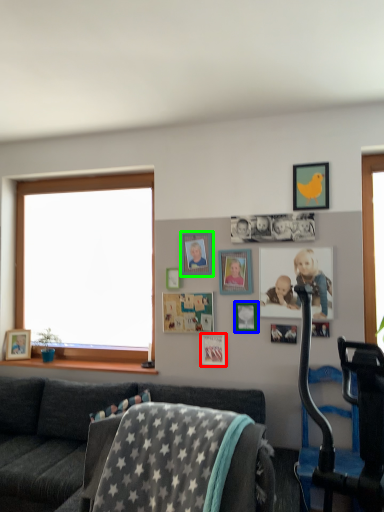
Question: Estimate the real-world distances between objects in this image. Which object is farther from picture frame (highlighted by a red box), picture frame (highlighted by a blue box) or picture frame (highlighted by a green box)?

Choices:
 (A) picture frame
 (B) picture frame

Answer: (B)